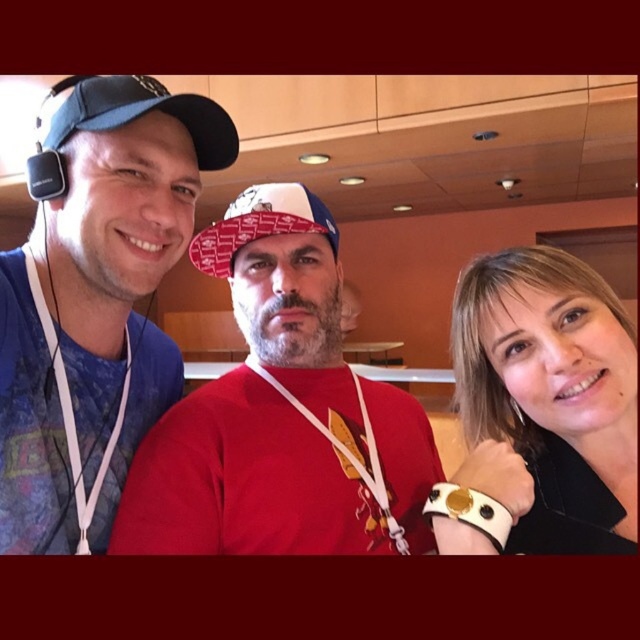
In the scene shown: In the scene described, there are two blue fabric items at the left side of the image. Which one is positioned further to the left between the blue fabric shirt at left and the blue fabric baseball cap at left?

The blue fabric shirt at left is positioned further to the left compared to the blue fabric baseball cap at left.

Based on the scene description, where is the blue fabric shirt at left located in the image?

The blue fabric shirt at left is located at point (93, 300) in the image.

You are a photographer adjusting the camera settings to focus on the smooth white bracelet at right. Given that the camera can only focus on objects within a 0.1 unit radius from the center point, would the bracelet be in focus if the center is set at coordinates 0.6, 0.8?

The smooth white bracelet at right is located at point (552, 392). The distance from the center (512, 384) is calculated as sqrt. Since the maximum allowed distance is 0.1 units, the bracelet would be within the focus range and thus in focus.